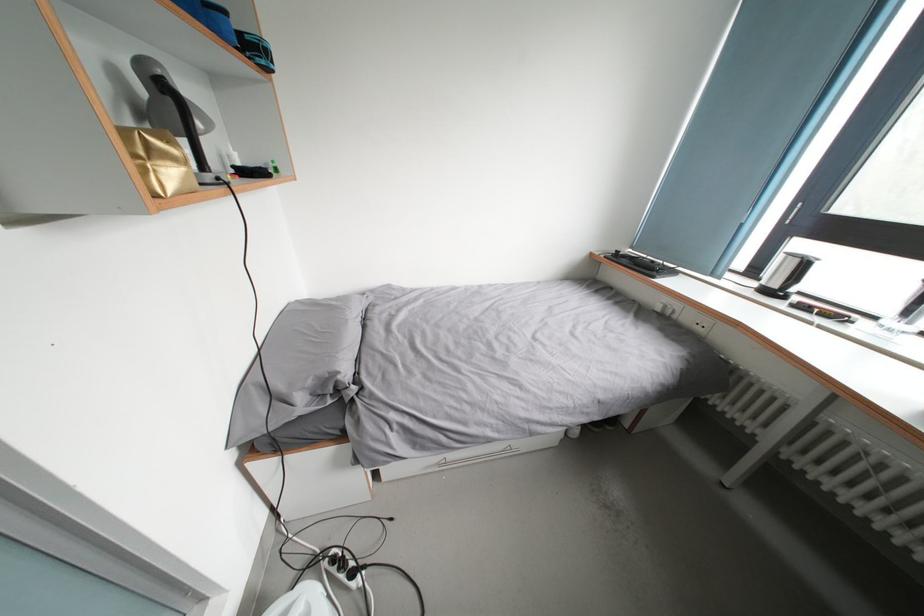
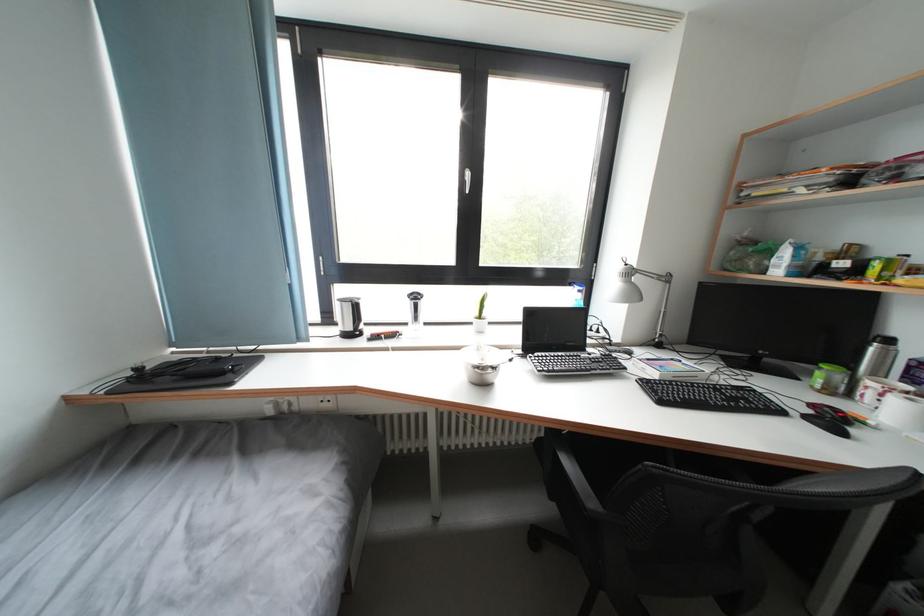
Question: The camera is either moving clockwise (left) or counter-clockwise (right) around the object. The first image is from the beginning of the video and the second image is from the end. Is the camera moving left or right when shooting the video?

Choices:
 (A) Left
 (B) Right

Answer: (A)